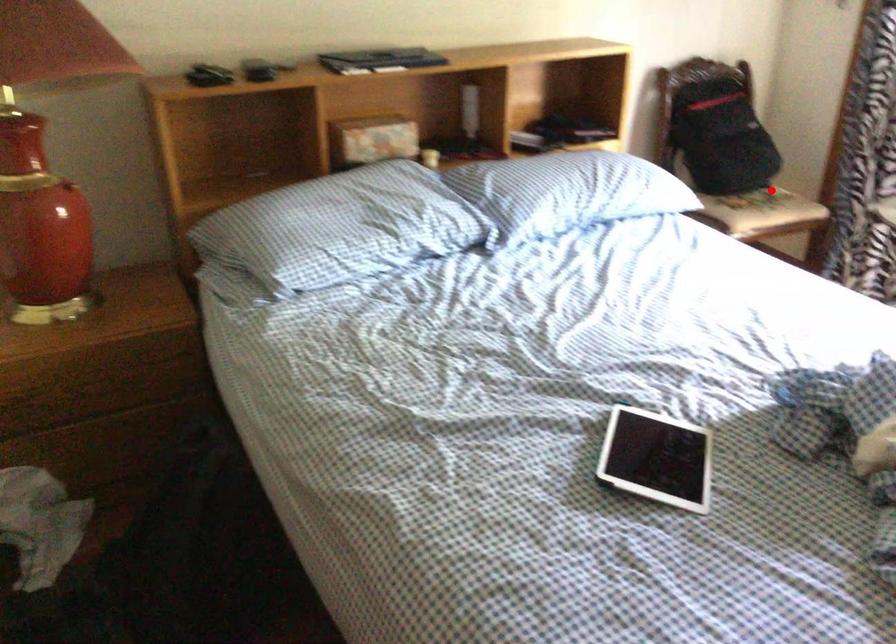
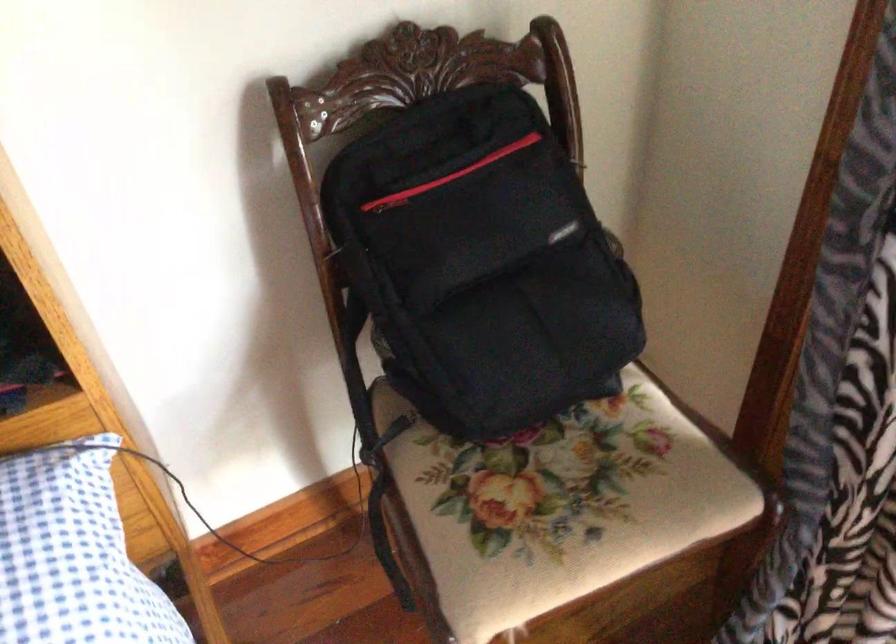
Question: A red point is marked in image1. In image2, is the corresponding 3D point closer to the camera or farther? Reply with the corresponding letter.

Choices:
 (A) The corresponding 3D point is closer.
 (B) The corresponding 3D point is farther.

Answer: (A)